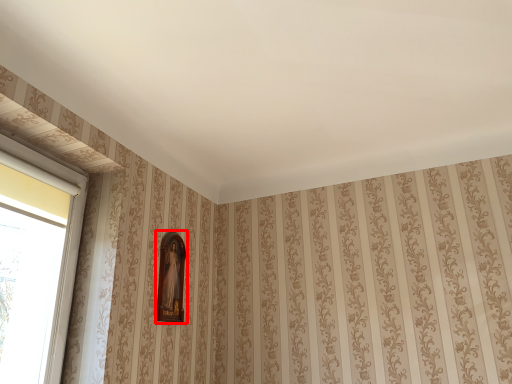
Question: From the image's perspective, where is picture frame (annotated by the red box) located in relation to window in the image?

Choices:
 (A) below
 (B) above

Answer: (A)